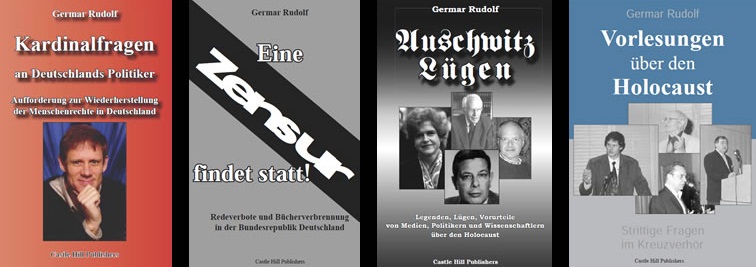
Identify the location of fourth book from right. The image size is (756, 267). (82, 127).